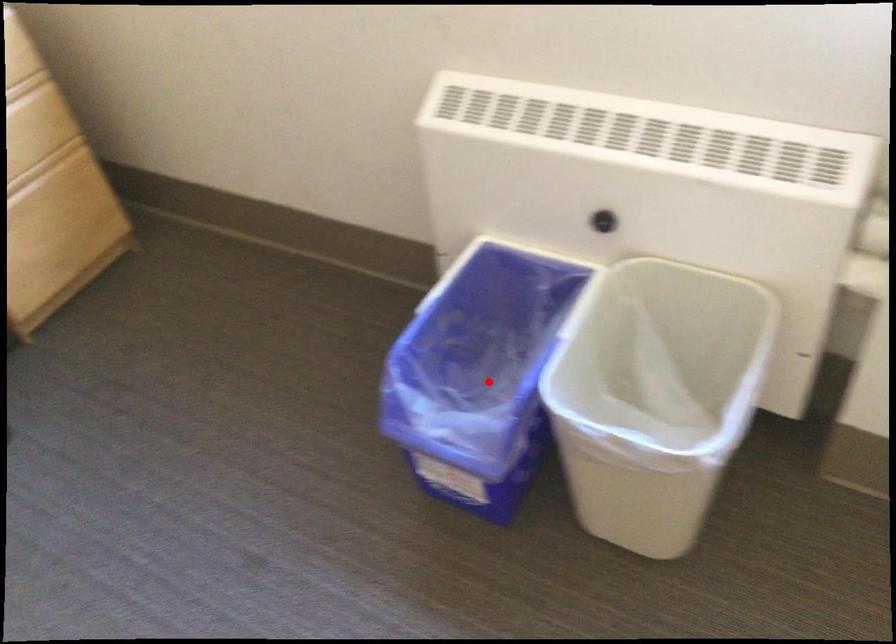
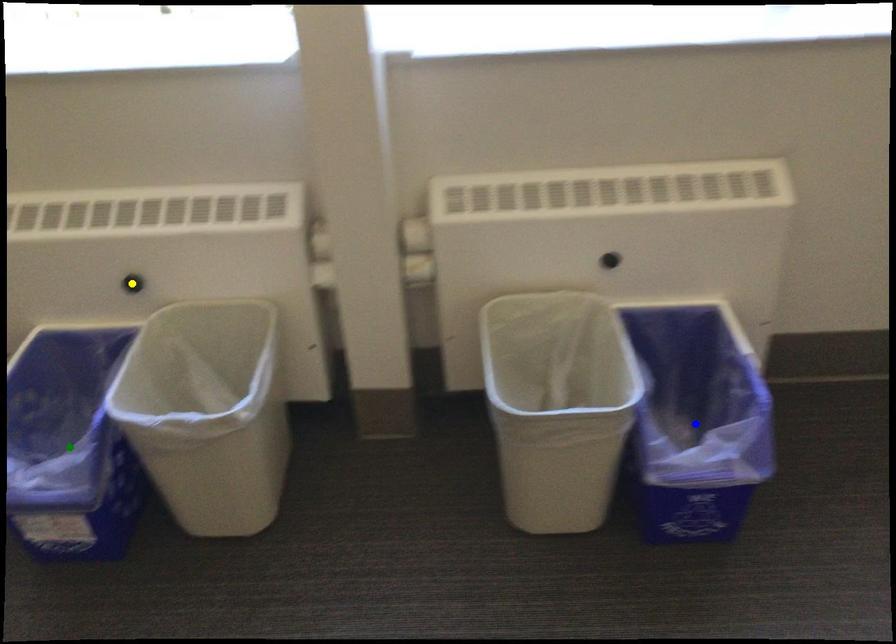
Question: I am providing you with two images of the same scene from different viewpoints. A red point is marked on the first image. You are given multiple points on the second image. Which point in image 2 is actually the same real-world point as the red point in image 1?

Choices:
 (A) blue point
 (B) yellow point
 (C) green point

Answer: (C)